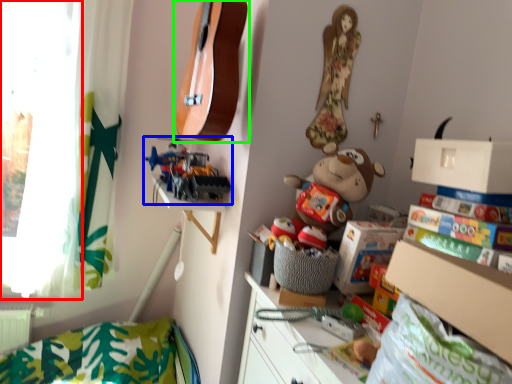
Question: Based on their relative distances, which object is nearer to window screen (highlighted by a red box)? Choose from toy (highlighted by a blue box) and guitar (highlighted by a green box).

Choices:
 (A) toy
 (B) guitar

Answer: (A)